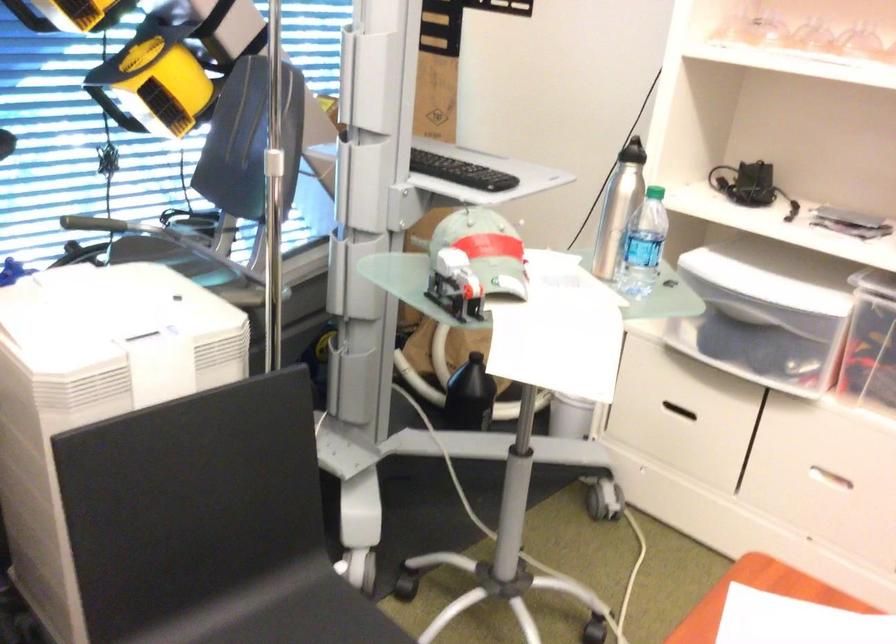
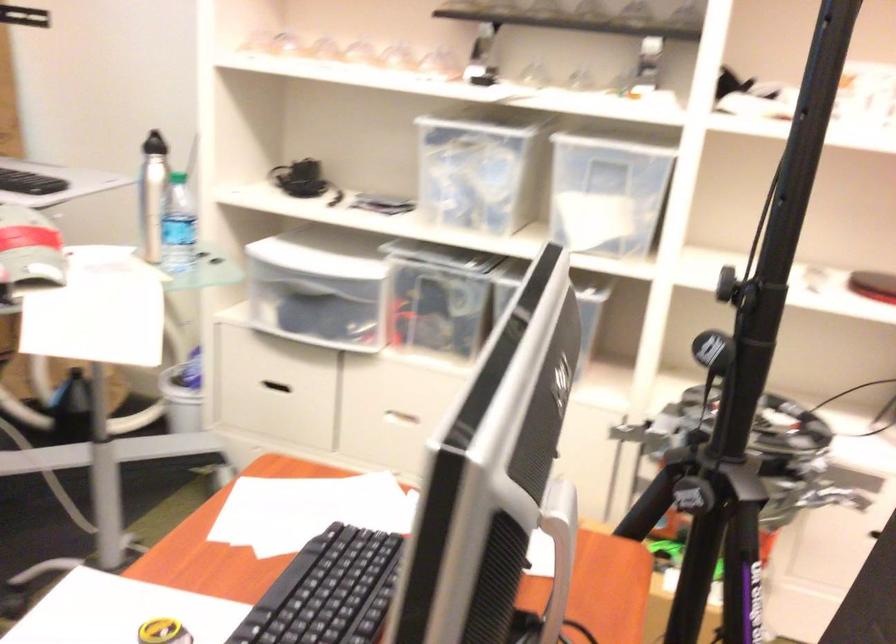
Find the pixel in the second image that matches (x=643, y=242) in the first image.

(177, 225)